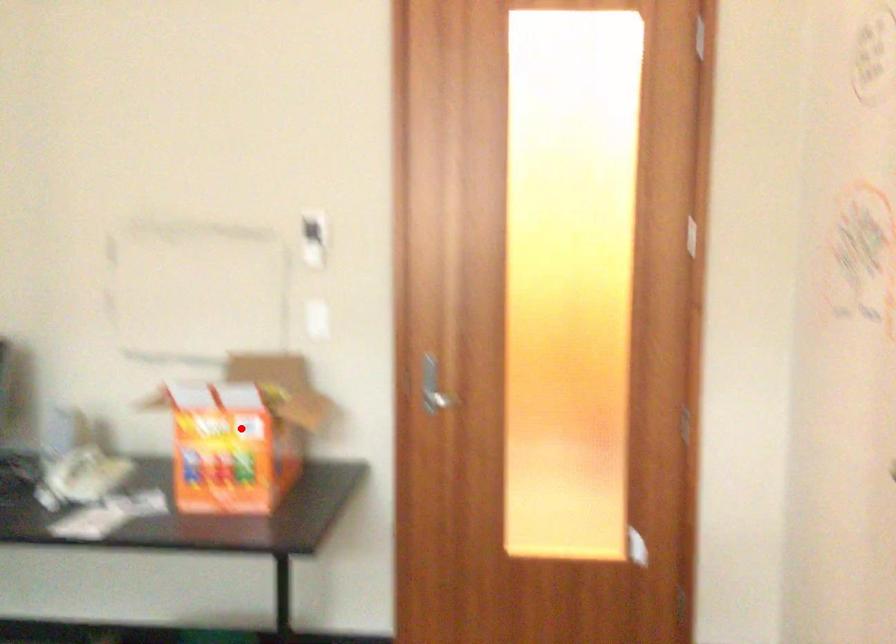
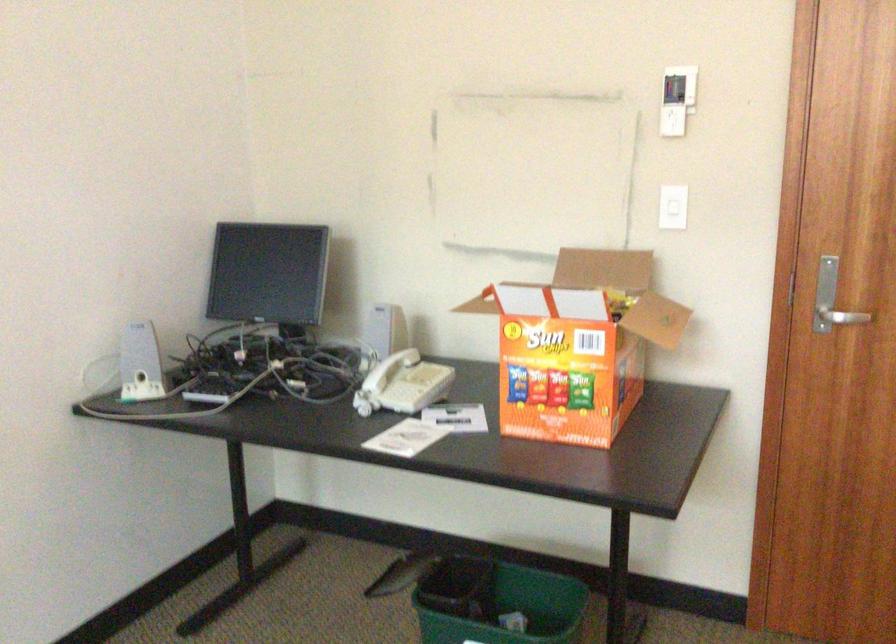
Find the pixel in the second image that matches the highlighted location in the first image.

(578, 345)